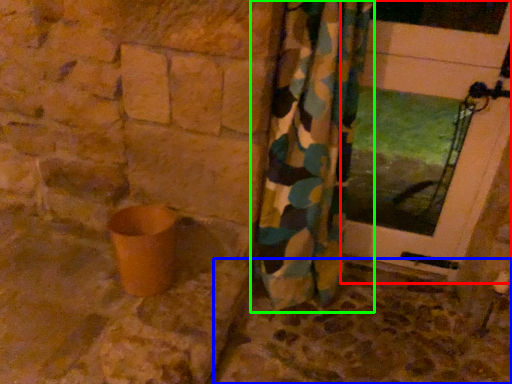
Question: Which object is positioned farthest from door (highlighted by a red box)? Select from concrete (highlighted by a blue box) and curtain (highlighted by a green box).

Choices:
 (A) concrete
 (B) curtain

Answer: (A)